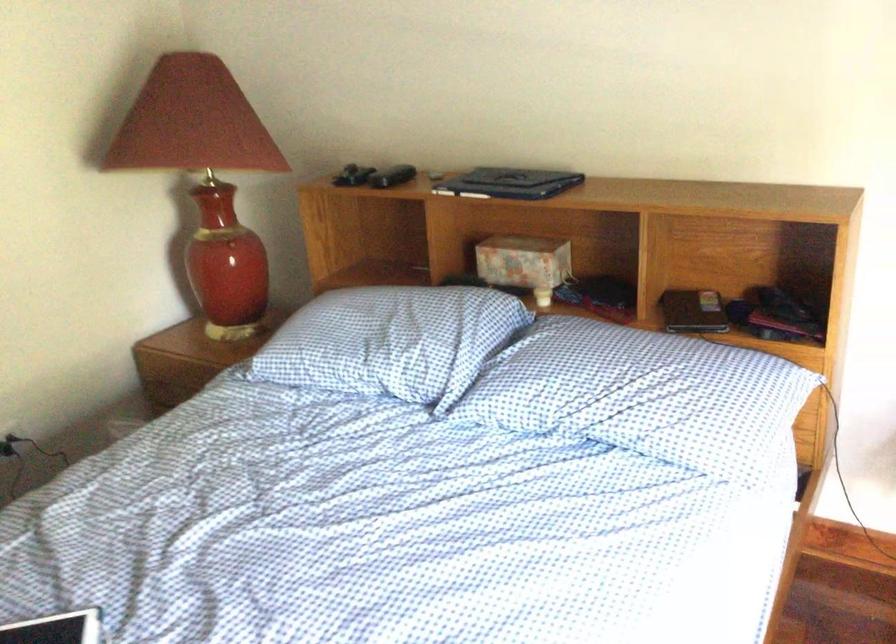
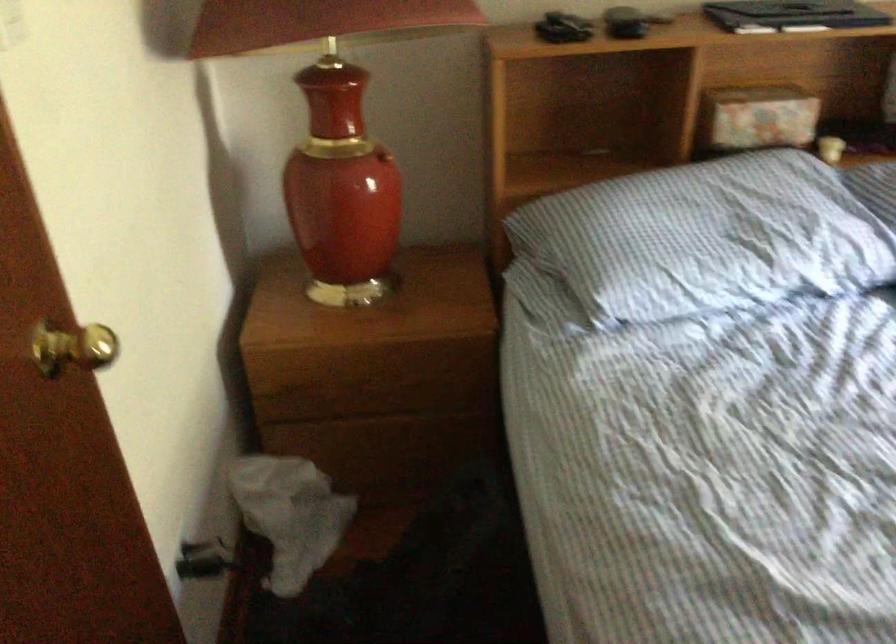
In the second image, find the point that corresponds to (x=524, y=298) in the first image.

(830, 149)